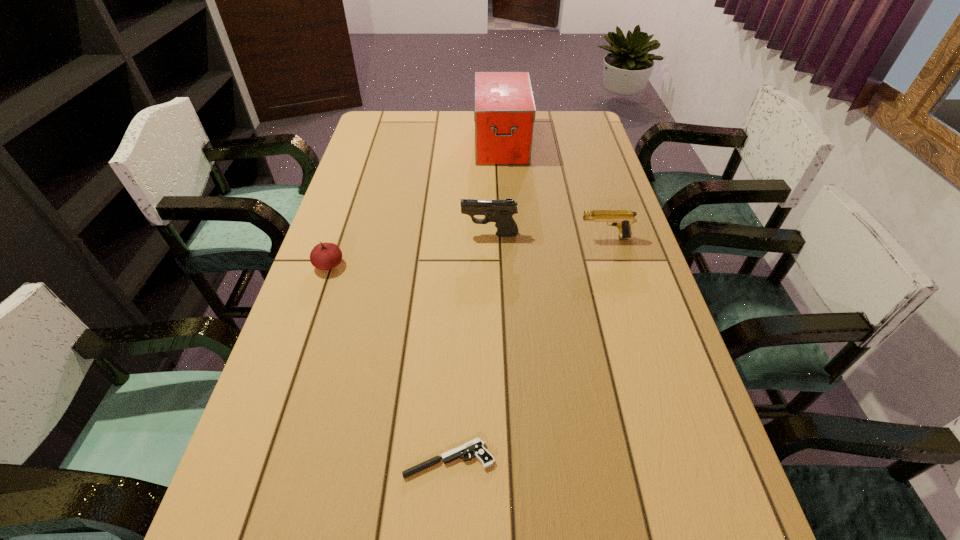
The width and height of the screenshot is (960, 540). I want to click on the first-aid kit, so click(504, 110).

Find the location of a particular element. Image resolution: width=960 pixels, height=540 pixels. the farthest object is located at coordinates (504, 110).

Find the location of a particular element. Image resolution: width=960 pixels, height=540 pixels. the second tallest object is located at coordinates (499, 211).

This screenshot has width=960, height=540. Identify the location of the rightmost object. (x=622, y=219).

The height and width of the screenshot is (540, 960). In order to click on the third tallest object in this screenshot , I will do `click(622, 219)`.

Where is `tomato`? tomato is located at coordinates (324, 256).

Locate an element on the screen. This screenshot has width=960, height=540. the leftmost object is located at coordinates (324, 256).

You are a GUI agent. You are given a task and a screenshot of the screen. Output one action in this format:
    pyautogui.click(x=<x>, y=<y>)
    Task: Click on the shortest object
    Image resolution: width=960 pixels, height=540 pixels.
    Given the screenshot: What is the action you would take?
    pyautogui.click(x=476, y=446)

I want to click on the nearest object, so tap(476, 446).

What are the coordinates of `vacant area situated on the handle side of the tallest object` in the screenshot? It's located at (505, 204).